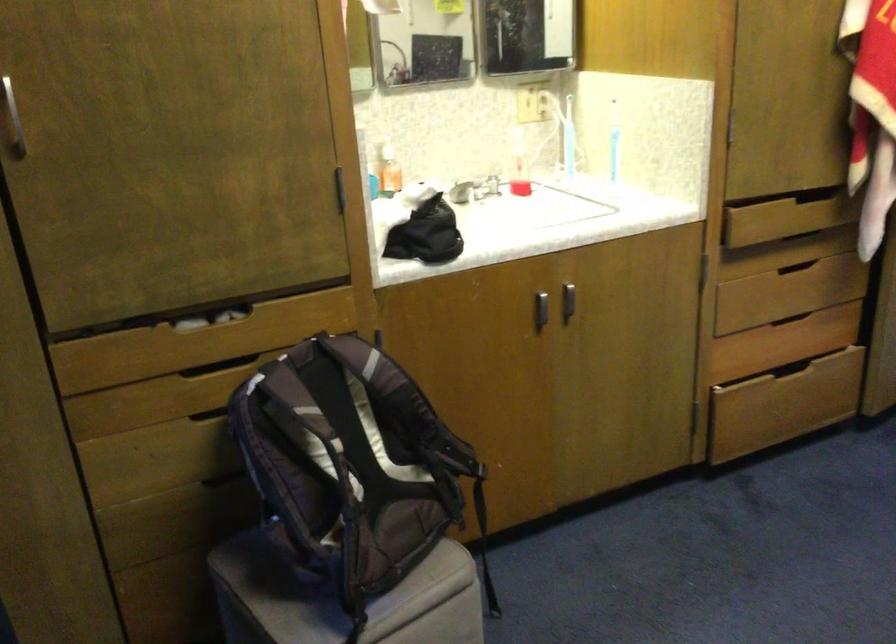
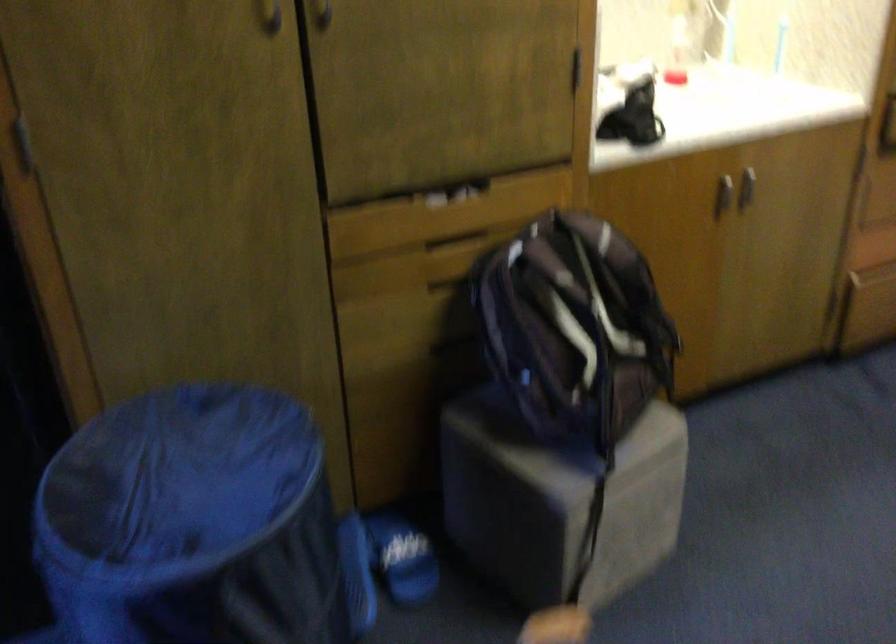
In the second image, find the point that corresponds to [543,310] in the first image.

(722, 194)